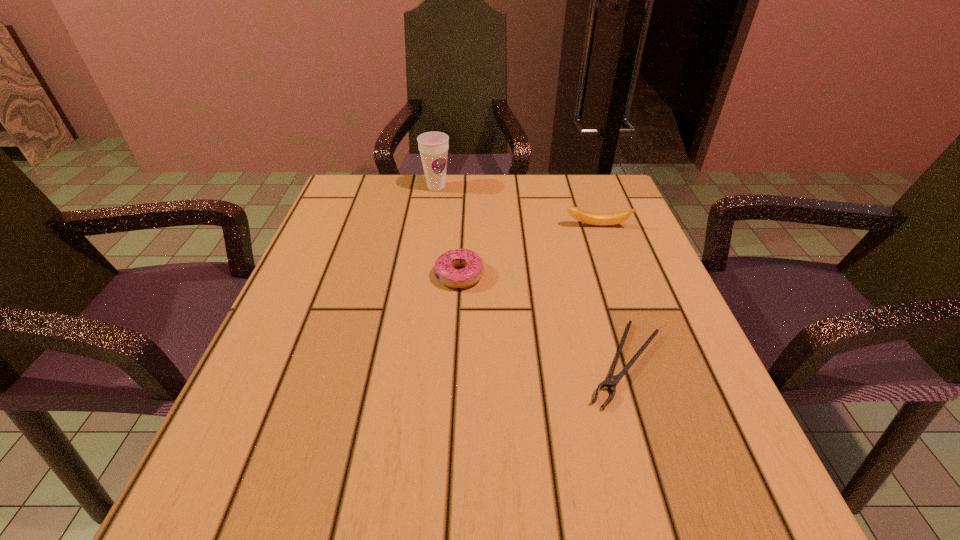
Find the location of a particular element. This screenshot has height=540, width=960. vacant space situated on the back of the second nearest object is located at coordinates (464, 188).

Locate an element on the screen. The width and height of the screenshot is (960, 540). free point located 0.130m on the front of the shortest object is located at coordinates (667, 502).

What are the coordinates of `cup at the far edge` in the screenshot? It's located at (433, 146).

Where is `banana at the far edge`? The image size is (960, 540). banana at the far edge is located at coordinates (600, 219).

You are a GUI agent. You are given a task and a screenshot of the screen. Output one action in this format:
    pyautogui.click(x=<x>, y=<y>)
    Task: Click on the banana that is at the right edge
    Image resolution: width=960 pixels, height=540 pixels.
    Given the screenshot: What is the action you would take?
    600,219

Identify the location of tongs that is at the right edge. The height and width of the screenshot is (540, 960). (611, 381).

Find the location of a particular element. The width and height of the screenshot is (960, 540). object situated at the far right corner is located at coordinates (600, 219).

In the image, there is a desktop. At what (x,y) coordinates should I click in order to perform the action: click on vacant area at the far edge. Please return your answer as a coordinate pair (x, y). The image size is (960, 540). Looking at the image, I should click on (561, 204).

In order to click on vacant region at the near edge in this screenshot , I will do `click(641, 526)`.

In the image, there is a desktop. Where is `free space at the left edge`? free space at the left edge is located at coordinates (316, 350).